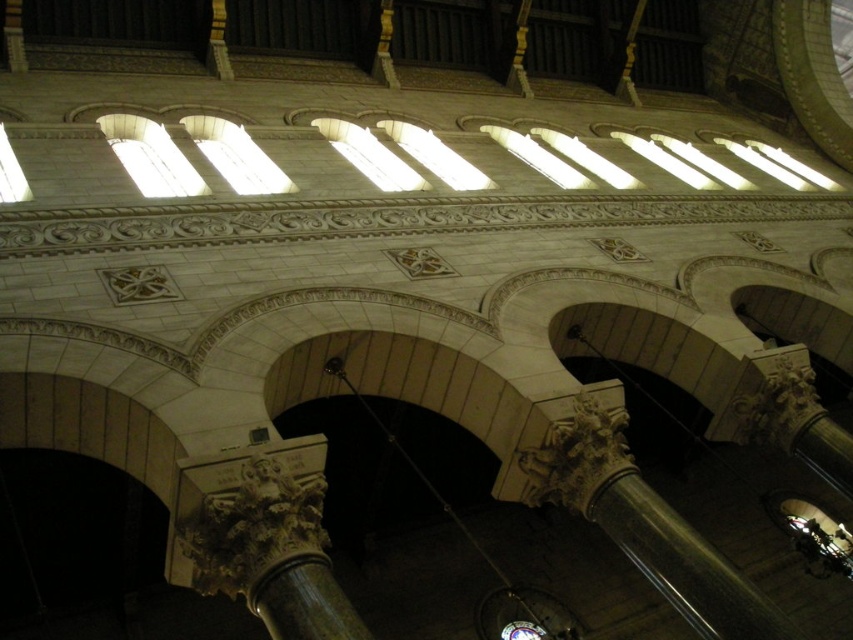
Question: Does carved stone column at center have a smaller size compared to white glass windows at upper center?

Choices:
 (A) yes
 (B) no

Answer: (A)

Question: Can you confirm if white glass windows at upper center is smaller than clear glass windows at center?

Choices:
 (A) yes
 (B) no

Answer: (A)

Question: Which point is closer to the camera?

Choices:
 (A) (15, 189)
 (B) (202, 124)
 (C) (189, 186)

Answer: (A)

Question: Can you confirm if white glass window at upper center is thinner than clear glass window at upper left?

Choices:
 (A) yes
 (B) no

Answer: (B)

Question: Which point is farther to the camera?

Choices:
 (A) (433, 140)
 (B) (190, 548)

Answer: (A)

Question: Which point is farther from the camera taking this photo?

Choices:
 (A) (445, 156)
 (B) (222, 168)
 (C) (19, 173)

Answer: (A)